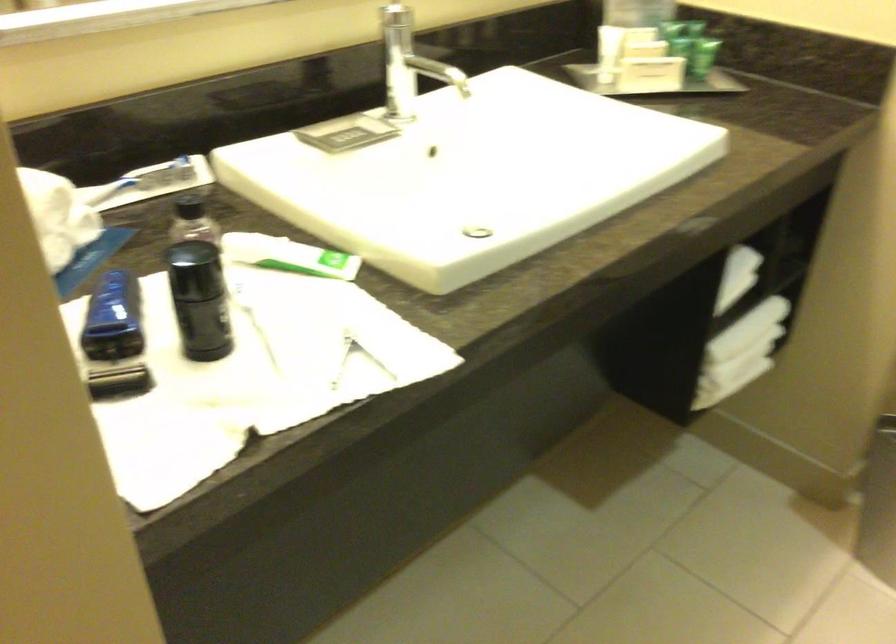
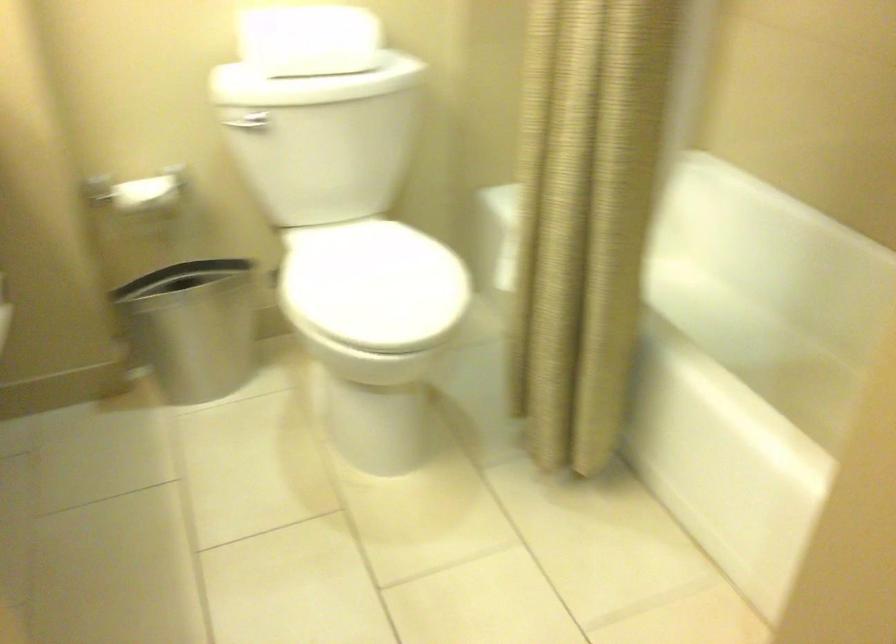
First-person continuous shooting, in which direction is the camera rotating?

The rotation direction of the camera is right-down.